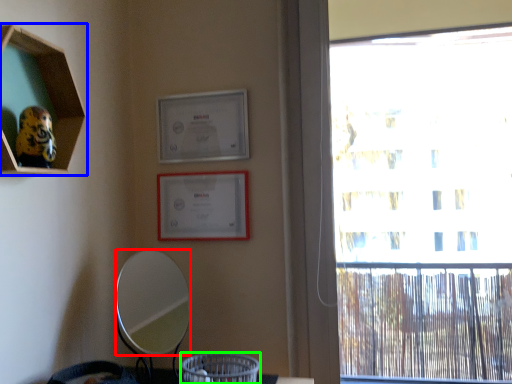
Question: Based on their relative distances, which object is farther from mirror (highlighted by a red box)? Choose from shelf (highlighted by a blue box) and basket (highlighted by a green box).

Choices:
 (A) shelf
 (B) basket

Answer: (A)